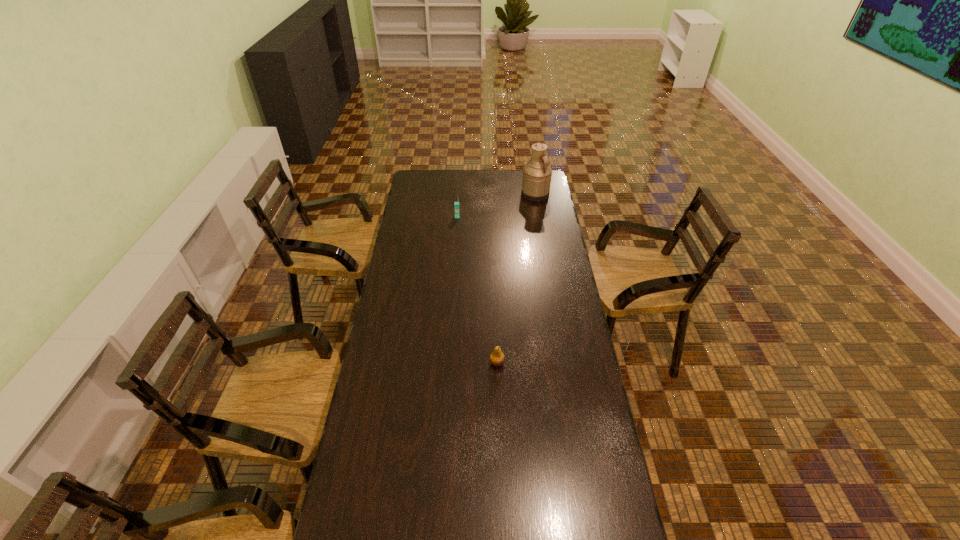
Identify the location of object at the right edge. (537, 173).

Where is `object at the far right corner`? The height and width of the screenshot is (540, 960). object at the far right corner is located at coordinates (537, 173).

Image resolution: width=960 pixels, height=540 pixels. In the image, there is a desktop. In order to click on vacant space at the far edge in this screenshot , I will do `click(492, 186)`.

Where is `vacant space at the left edge`? Image resolution: width=960 pixels, height=540 pixels. vacant space at the left edge is located at coordinates (383, 377).

Image resolution: width=960 pixels, height=540 pixels. In order to click on vacant space at the right edge in this screenshot , I will do `click(533, 210)`.

The height and width of the screenshot is (540, 960). Identify the location of free spot at the far left corner of the desktop. (414, 174).

Locate an element on the screen. The image size is (960, 540). vacant area between the rightmost object and the leftmost object is located at coordinates (496, 206).

Where is `free space between the pear and the rightmost object`? The width and height of the screenshot is (960, 540). free space between the pear and the rightmost object is located at coordinates (516, 279).

Identify the location of free area in between the leftmost object and the nearest object. (477, 289).

Locate an element on the screen. free spot between the pitcher and the cellular telephone is located at coordinates (496, 206).